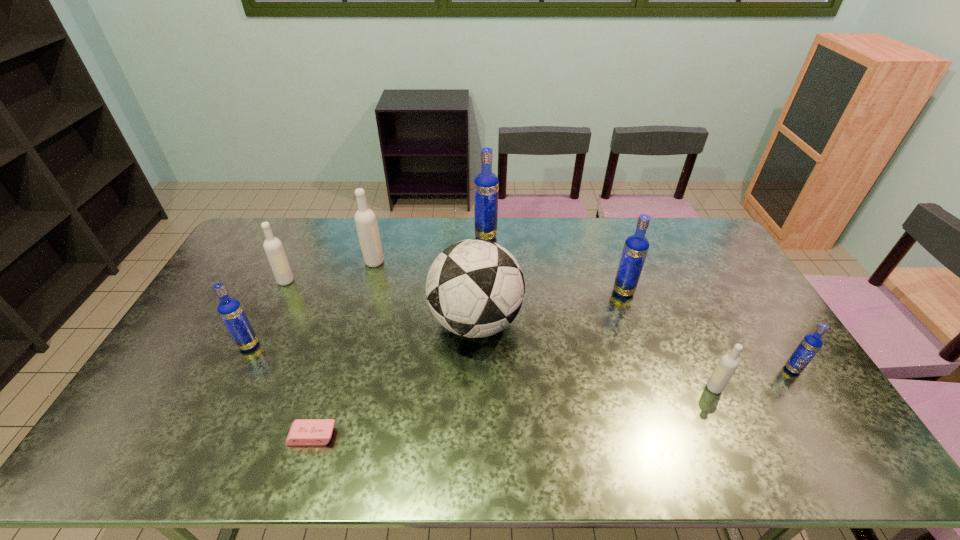
Locate an element on the screen. Image resolution: width=960 pixels, height=540 pixels. the second nearest white vodka is located at coordinates (273, 247).

Identify the location of the rightmost blue vodka. The height and width of the screenshot is (540, 960). (810, 345).

This screenshot has width=960, height=540. Identify the location of the rightmost object. (810, 345).

Locate an element on the screen. This screenshot has height=540, width=960. the eighth object from left to right is located at coordinates (728, 363).

Identify the location of the eighth farthest object. The height and width of the screenshot is (540, 960). (728, 363).

Find the location of `the nearest object`. the nearest object is located at coordinates (304, 432).

Find the location of a particular element. The width and height of the screenshot is (960, 540). eraser is located at coordinates (304, 432).

Locate an element on the screen. blank space located on the right of the farthest object is located at coordinates (531, 237).

This screenshot has width=960, height=540. I want to click on free space located on the right of the eighth nearest object, so point(398,262).

Identify the location of vacant space located on the back of the second blue vodka from right to left. (615, 269).